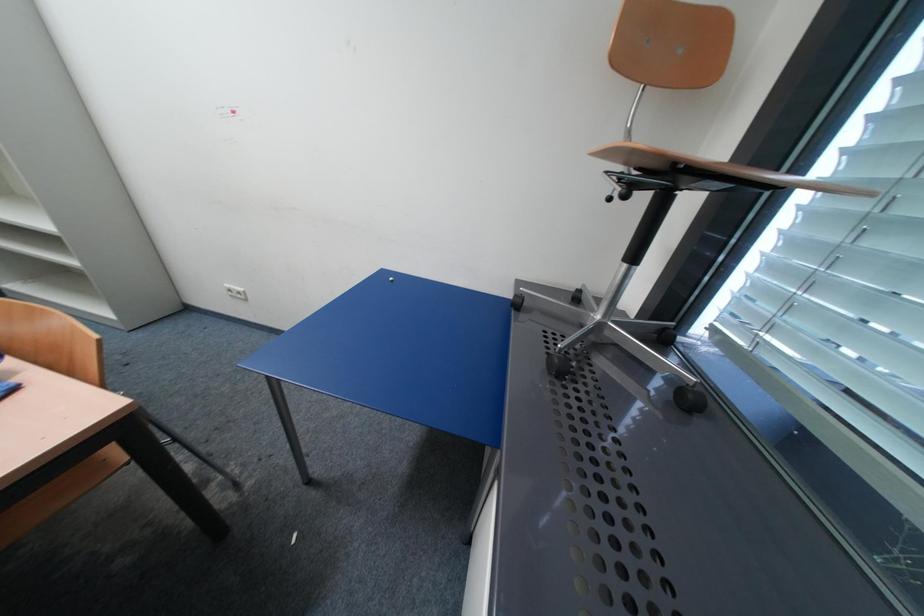
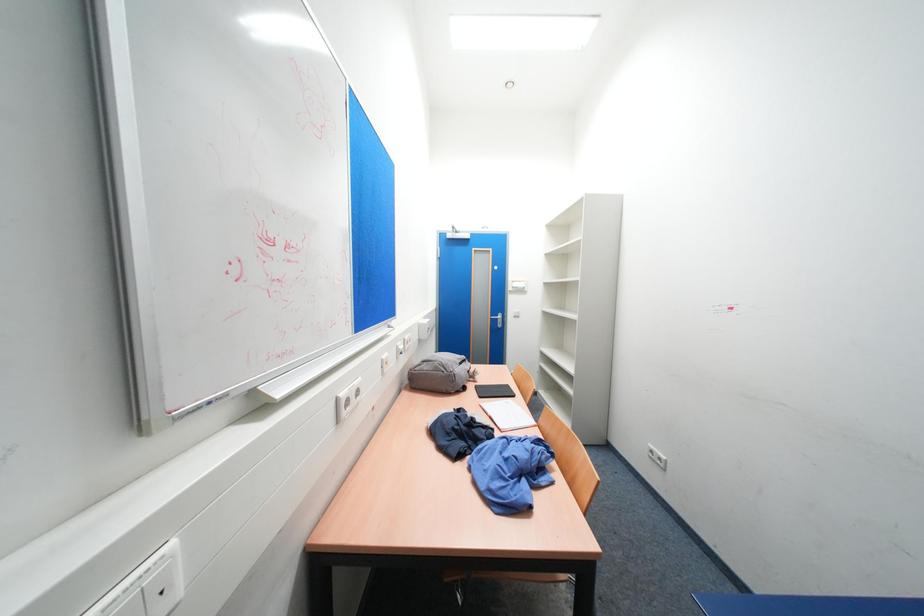
Question: The camera is either moving clockwise (left) or counter-clockwise (right) around the object. The first image is from the beginning of the video and the second image is from the end. Is the camera moving left or right when shooting the video?

Choices:
 (A) Left
 (B) Right

Answer: (B)